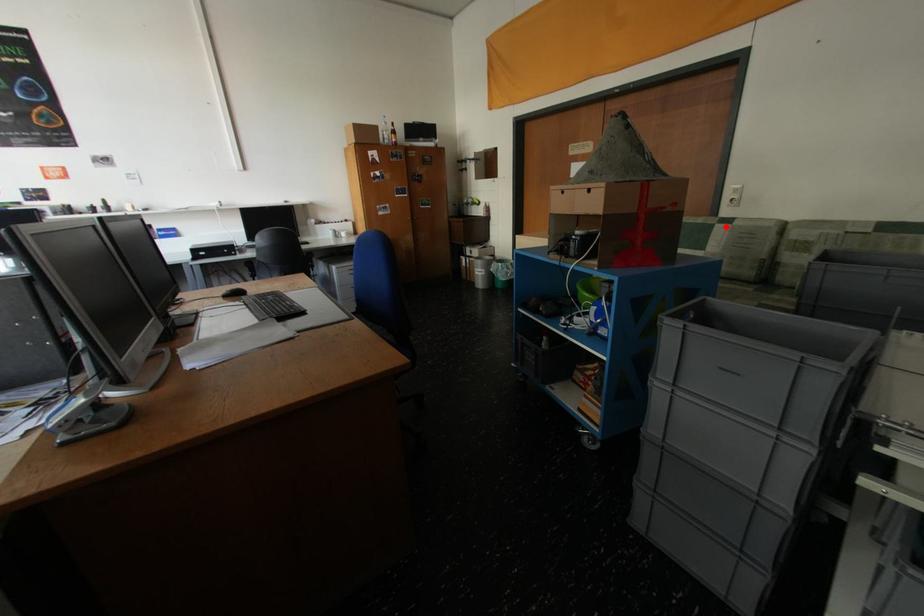
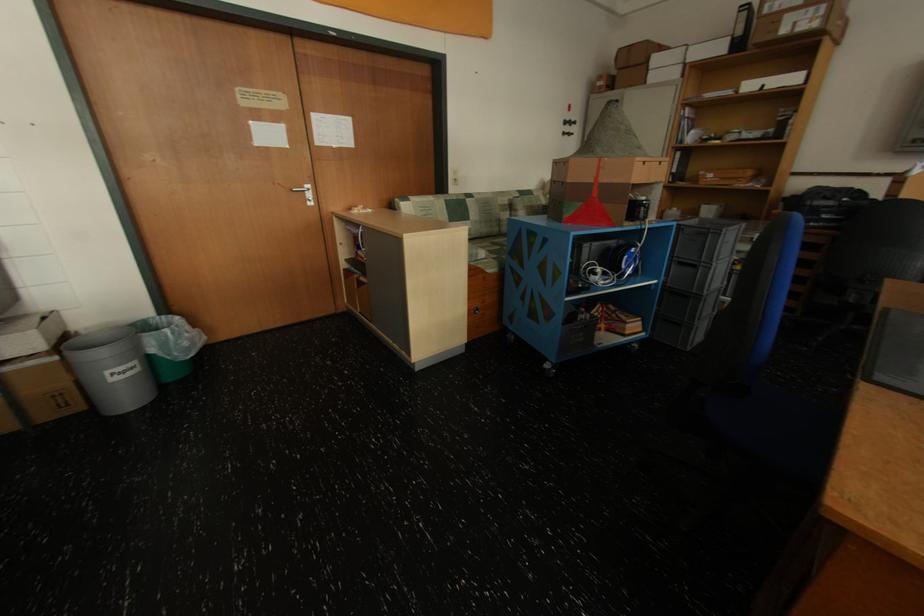
The point at the highlighted location is marked in the first image. Where is the corresponding point in the second image?

(476, 201)